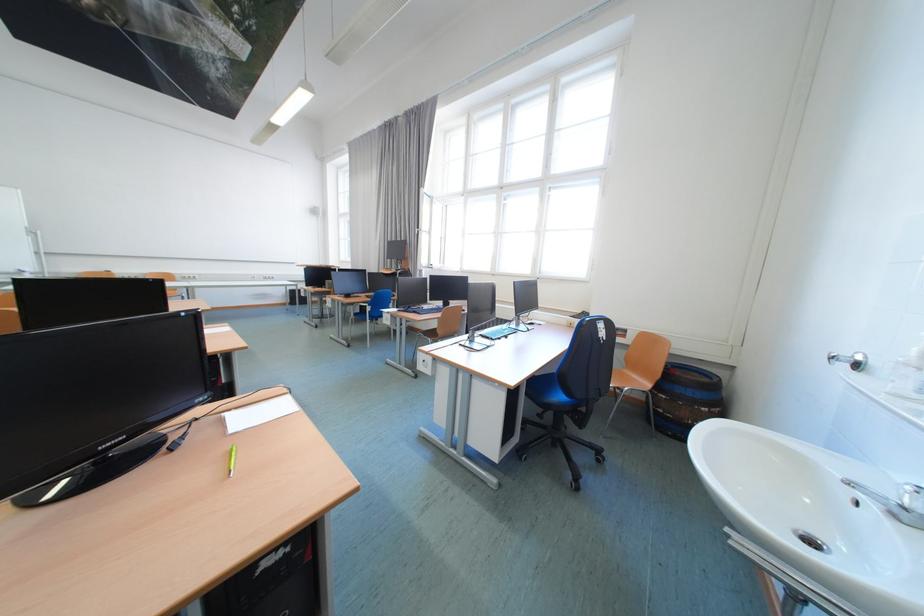
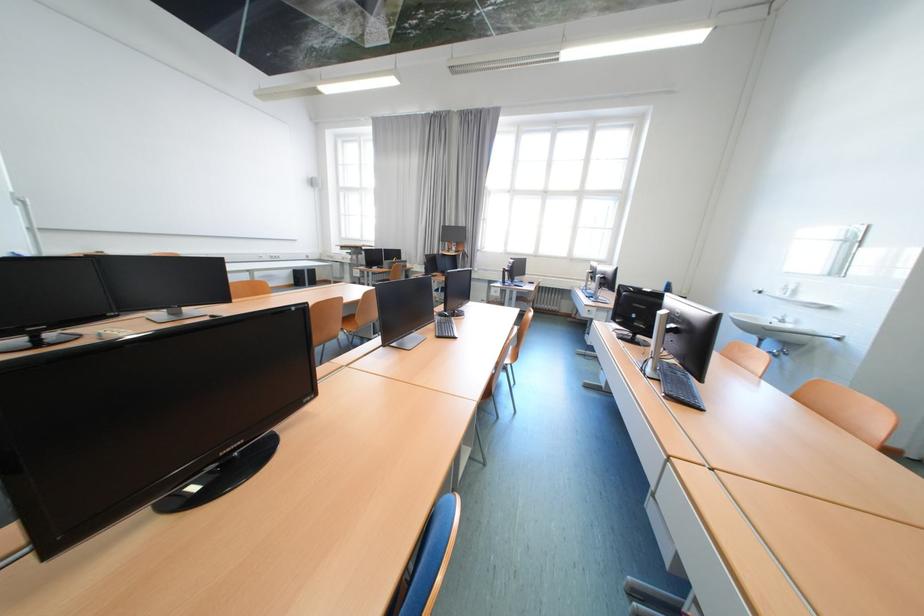
Question: The images are taken continuously from a first-person perspective. In which direction are you moving?

Choices:
 (A) Left
 (B) Right
 (C) Forward
 (D) Backward

Answer: (A)